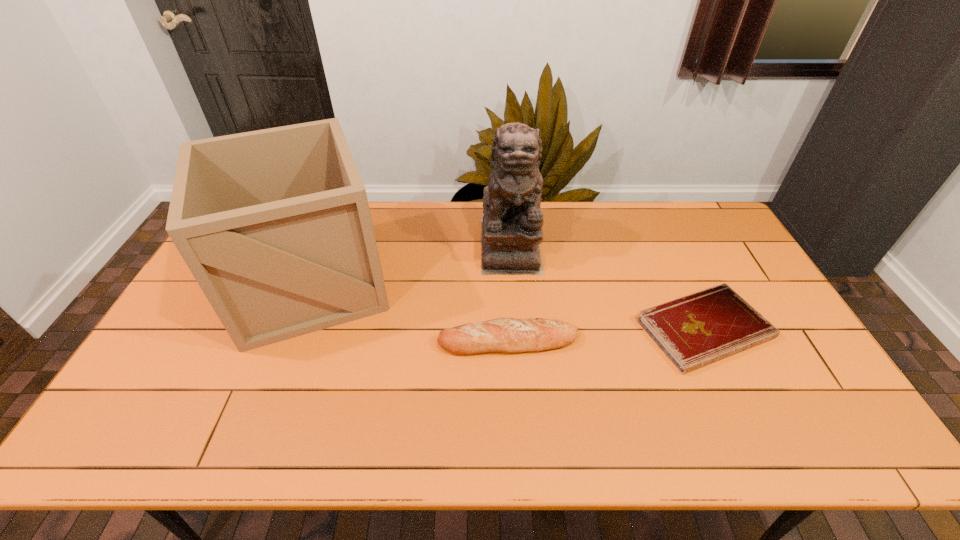
I want to click on free spot that satisfies the following two spatial constraints: 1. on the front-facing side of the sculpture; 2. on the right side of the shortest object, so click(517, 329).

This screenshot has height=540, width=960. I want to click on free location that satisfies the following two spatial constraints: 1. on the front side of the box; 2. on the right side of the second shortest object, so click(286, 341).

In order to click on free space that satisfies the following two spatial constraints: 1. on the front side of the leftmost object; 2. on the left side of the baguet in this screenshot , I will do `click(286, 341)`.

Find the location of a particular element. This screenshot has width=960, height=540. vacant area in the image that satisfies the following two spatial constraints: 1. on the front side of the box; 2. on the left side of the baguet is located at coordinates (286, 341).